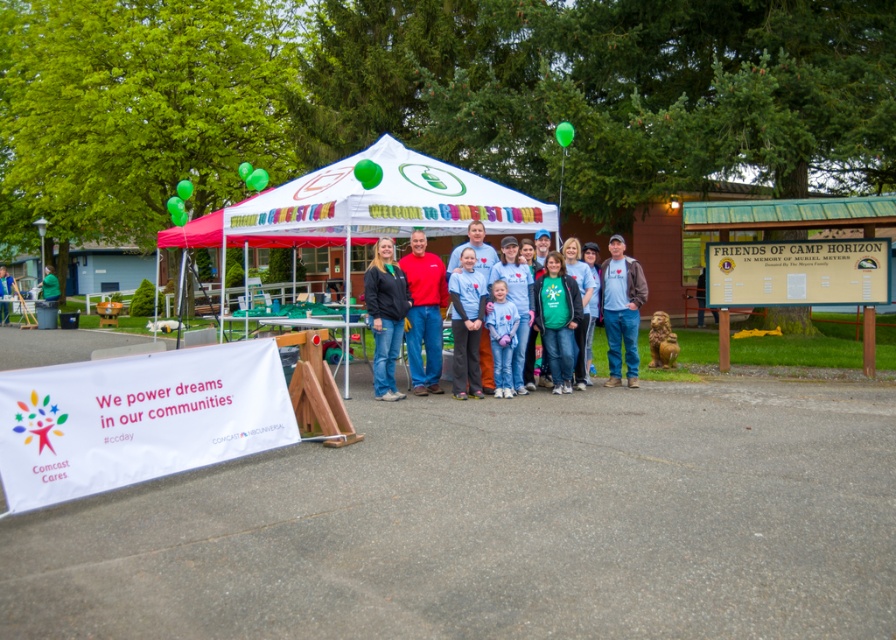
You are standing at the point marked as point (410, 204). There is a tree 11.21 meters away from you. Can you walk straight to the tree without any obstacles?

The tree is 11.21 meters away from point (410, 204). Since there are no obstacles mentioned in the scene description, you can walk straight to the tree.